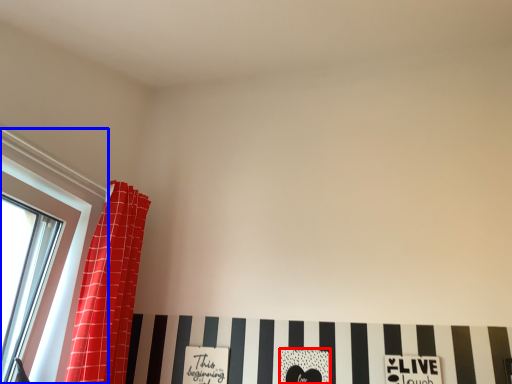
Question: Which object is further to the camera taking this photo, print (highlighted by a red box) or window (highlighted by a blue box)?

Choices:
 (A) print
 (B) window

Answer: (A)